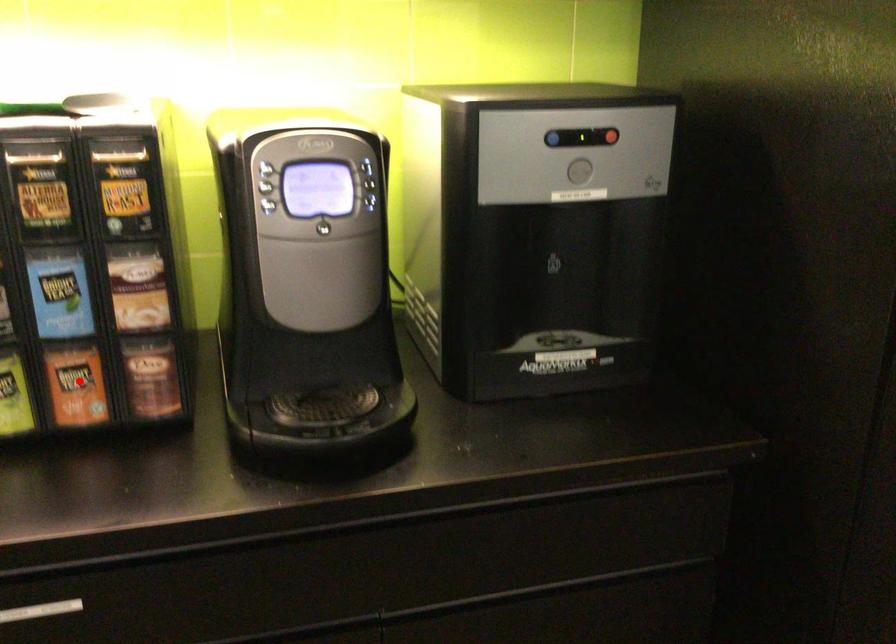
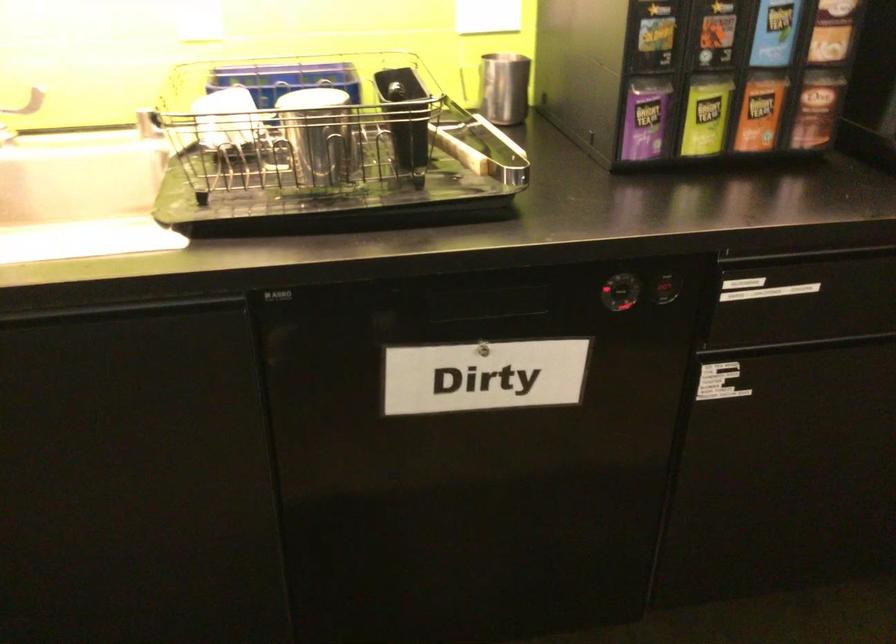
Question: A red point is marked in image1. In image2, is the corresponding 3D point closer to the camera or farther? Reply with the corresponding letter.

Choices:
 (A) The corresponding 3D point is closer.
 (B) The corresponding 3D point is farther.

Answer: (B)